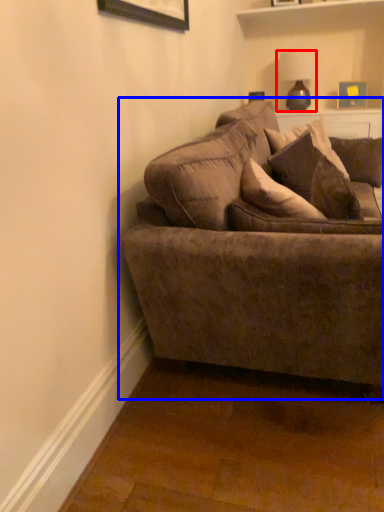
Question: Which object appears closest to the camera in this image, lamp (highlighted by a red box) or studio couch (highlighted by a blue box)?

Choices:
 (A) lamp
 (B) studio couch

Answer: (B)